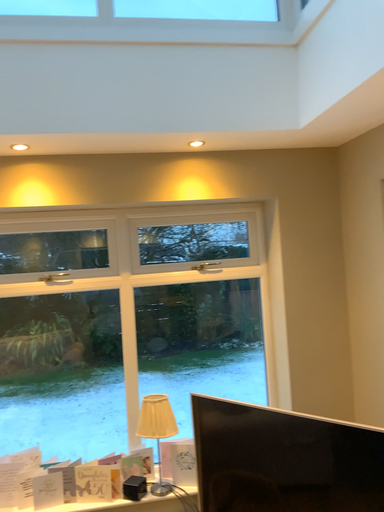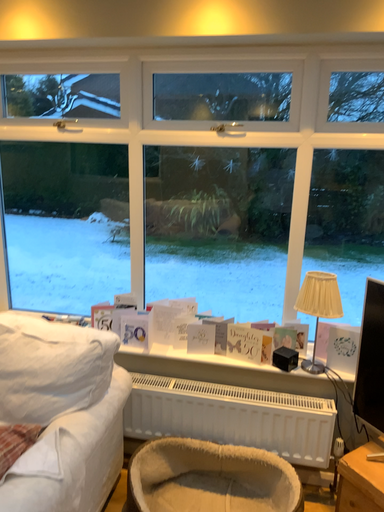
Question: How did the camera likely rotate when shooting the video?

Choices:
 (A) rotated right
 (B) rotated left

Answer: (B)